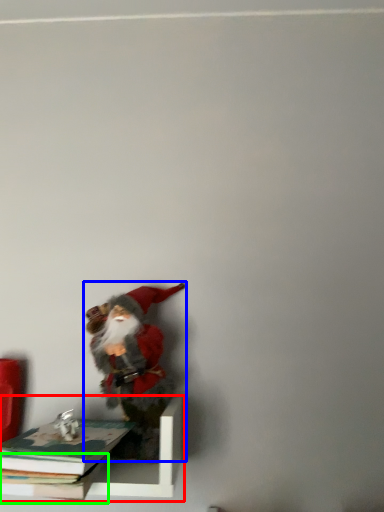
Question: Based on their relative distances, which object is farther from shelf (highlighted by a red box)? Choose from person (highlighted by a blue box) and book (highlighted by a green box).

Choices:
 (A) person
 (B) book

Answer: (A)